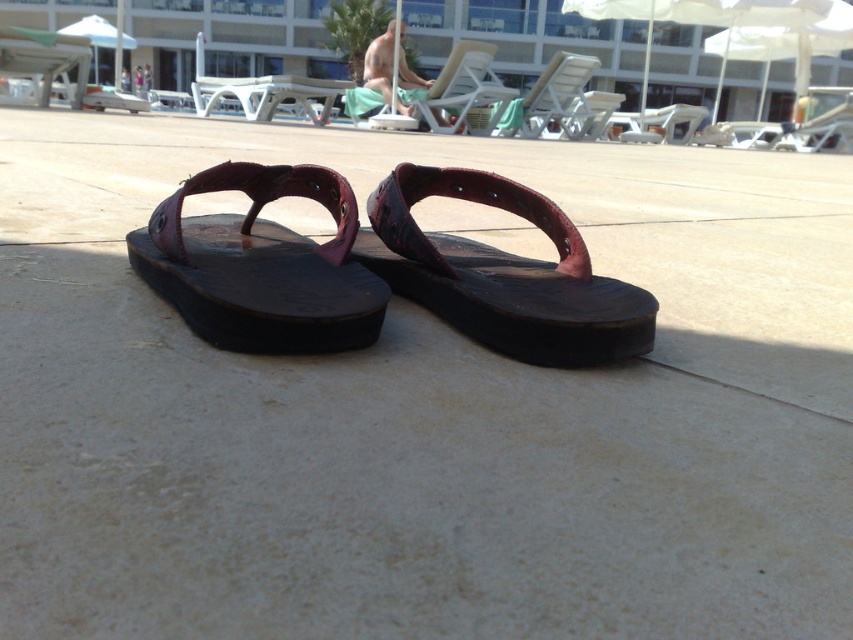
Question: Which point is closer to the camera?

Choices:
 (A) (293, 305)
 (B) (492, 180)
 (C) (395, 70)

Answer: (A)

Question: Estimate the real-world distances between objects in this image. Which object is farther from the leather-like dark brown sandal at center?

Choices:
 (A) shiny leather sandal at center
 (B) naked man at center

Answer: (B)

Question: Is leather-like dark brown sandal at center bigger than shiny leather sandal at center?

Choices:
 (A) no
 (B) yes

Answer: (B)

Question: Among these objects, which one is nearest to the camera?

Choices:
 (A) naked man at center
 (B) leather-like dark brown sandal at center
 (C) shiny leather sandal at center

Answer: (B)

Question: Is the position of leather-like dark brown sandal at center more distant than that of naked man at center?

Choices:
 (A) yes
 (B) no

Answer: (B)

Question: Does leather-like dark brown sandal at center come behind shiny leather sandal at center?

Choices:
 (A) no
 (B) yes

Answer: (A)